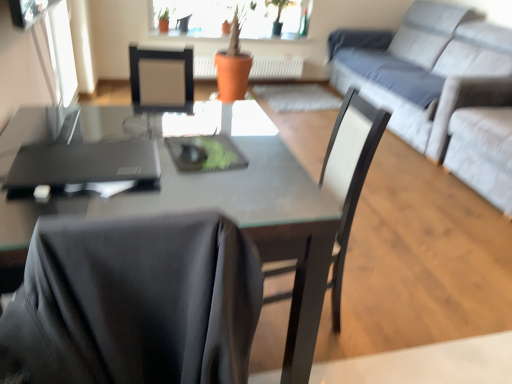
Question: In terms of width, does orange matte pot at center look wider or thinner when compared to black matte chair at center?

Choices:
 (A) thin
 (B) wide

Answer: (A)

Question: Considering the positions of point (269, 72) and point (336, 301), is point (269, 72) closer or farther from the camera than point (336, 301)?

Choices:
 (A) closer
 (B) farther

Answer: (B)

Question: Which of these objects is positioned closest to the matte black desk at center?

Choices:
 (A) light gray fabric couch at upper right
 (B) transparent glass window screen at upper left
 (C) black matte laptop at left
 (D) orange matte pot at center
 (E) black matte chair at center

Answer: (C)

Question: Which object is the closest to the black matte chair at center?

Choices:
 (A) light gray fabric couch at upper right
 (B) black matte laptop at left
 (C) matte black desk at center
 (D) orange matte pot at center
 (E) transparent glass window screen at upper left

Answer: (C)